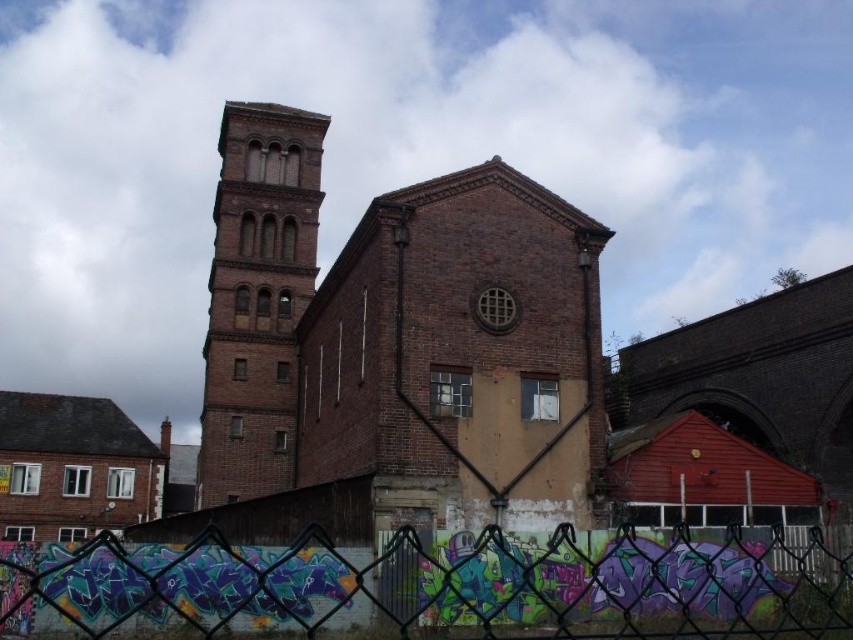
Question: In this image, where is metallic chain-link fence at lower center located relative to brown brick tower at center-left?

Choices:
 (A) left
 (B) right

Answer: (B)

Question: Which point appears farthest from the camera in this image?

Choices:
 (A) (268, 221)
 (B) (556, 618)

Answer: (A)

Question: Which point is closer to the camera?

Choices:
 (A) metallic chain-link fence at lower center
 (B) brown brick tower at center-left

Answer: (A)

Question: Is metallic chain-link fence at lower center smaller than brown brick tower at center-left?

Choices:
 (A) no
 (B) yes

Answer: (B)

Question: Among these objects, which one is nearest to the camera?

Choices:
 (A) brown brick tower at center-left
 (B) metallic chain-link fence at lower center

Answer: (B)

Question: Is metallic chain-link fence at lower center to the left of brown brick tower at center-left from the viewer's perspective?

Choices:
 (A) yes
 (B) no

Answer: (B)